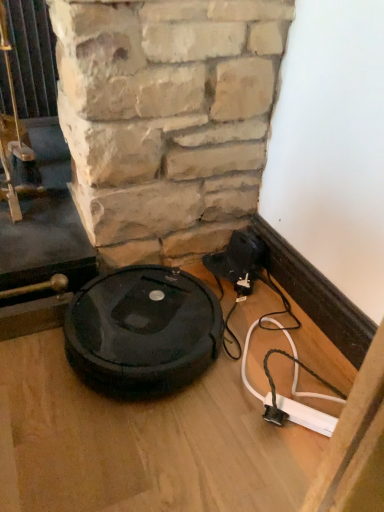
The width and height of the screenshot is (384, 512). What are the coordinates of `free spot above black plastic robot vacuum cleaner at lower left (from a real-world perspective)` in the screenshot? It's located at (145, 311).